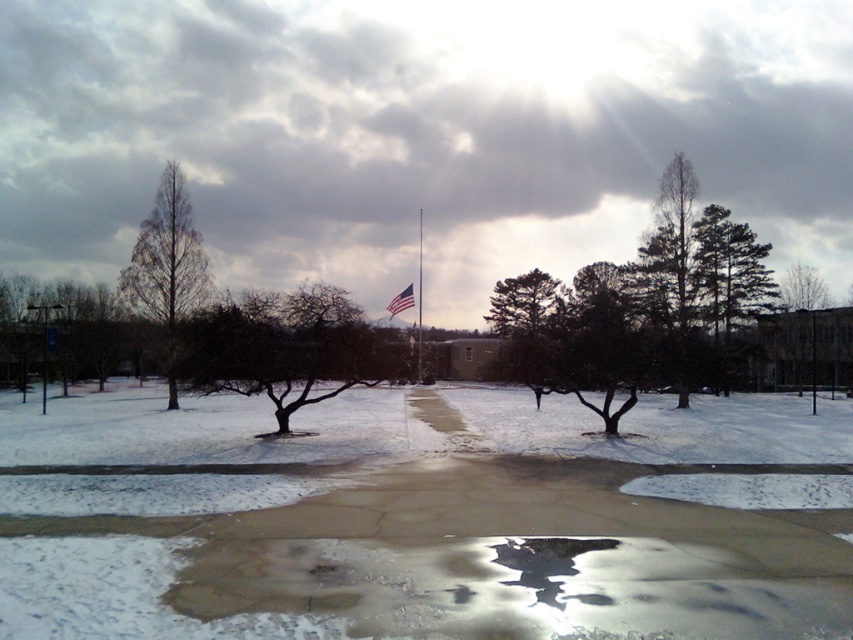
Who is positioned more to the left, white powdery snow at center or polished metal flag pole at center?

From the viewer's perspective, polished metal flag pole at center appears more on the left side.

Which is more to the right, white powdery snow at center or polished metal flag pole at center?

From the viewer's perspective, white powdery snow at center appears more on the right side.

Measure the distance between point (x=457, y=435) and camera.

Point (x=457, y=435) is 22.64 meters from camera.

I want to click on white powdery snow at center, so click(425, 518).

Which is in front, point (310, 317) or point (418, 291)?

Point (310, 317) is more forward.

Is brown matte tree at center behind polished metal flag pole at center?

No, brown matte tree at center is closer to the viewer.

You are a GUI agent. You are given a task and a screenshot of the screen. Output one action in this format:
    pyautogui.click(x=<x>, y=<y>)
    Task: Click on the brown matte tree at center
    This screenshot has width=853, height=640.
    Given the screenshot: What is the action you would take?
    pyautogui.click(x=285, y=348)

Can you confirm if white powdery snow at center is positioned below american flag at center?

Indeed, white powdery snow at center is positioned under american flag at center.

Which of these two, white powdery snow at center or american flag at center, stands taller?

With more height is american flag at center.

In order to click on white powdery snow at center in this screenshot , I will do `click(425, 518)`.